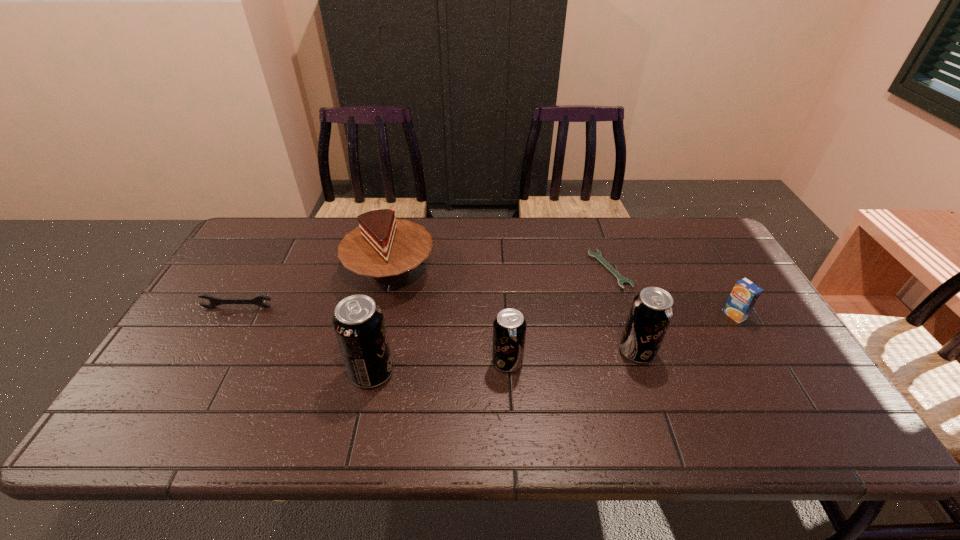
The height and width of the screenshot is (540, 960). Find the location of `the left wrench`. the left wrench is located at coordinates (257, 300).

Locate an element on the screen. vacant region located on the back of the leftmost soda can is located at coordinates (383, 323).

Identify the location of vacant space located on the back of the second soda can from right to left. (502, 266).

The height and width of the screenshot is (540, 960). Identify the location of free space located on the right of the rightmost soda can. (683, 352).

This screenshot has width=960, height=540. I want to click on vacant space located 0.100m on the back of the cake, so click(x=400, y=227).

At what (x,y) coordinates should I click in order to perform the action: click on vacant space located on the left of the orange_juice. Please return your answer as a coordinate pair (x, y). Looking at the image, I should click on (580, 315).

At what (x,y) coordinates should I click in order to perform the action: click on vacant space located on the front of the shorter wrench. Please return your answer as a coordinate pair (x, y). Image resolution: width=960 pixels, height=540 pixels. Looking at the image, I should click on (632, 335).

I want to click on vacant space located on the open ends of the left wrench, so [208, 360].

Identify the location of cake positioned at the far edge. (382, 247).

Where is `wrench present at the far edge`? Image resolution: width=960 pixels, height=540 pixels. wrench present at the far edge is located at coordinates (621, 280).